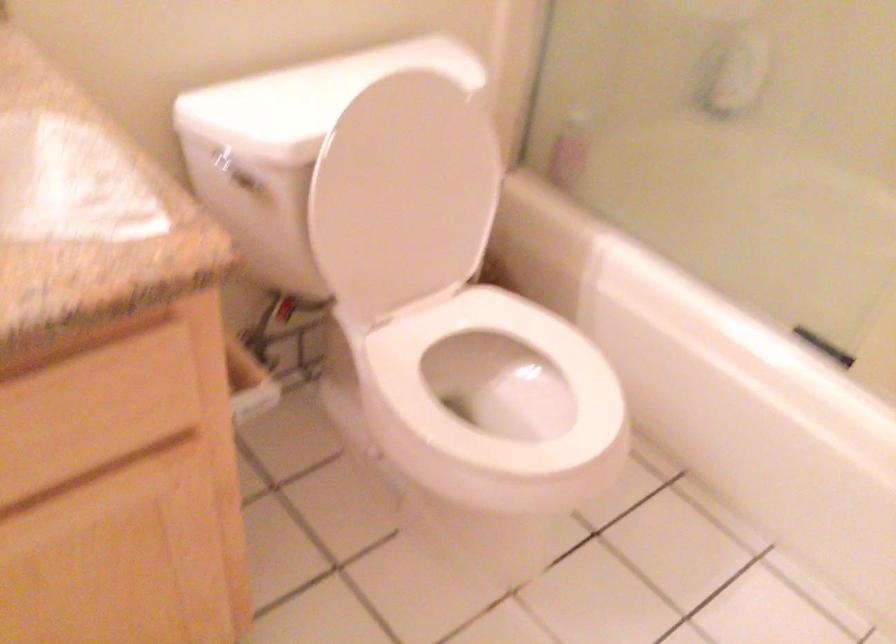
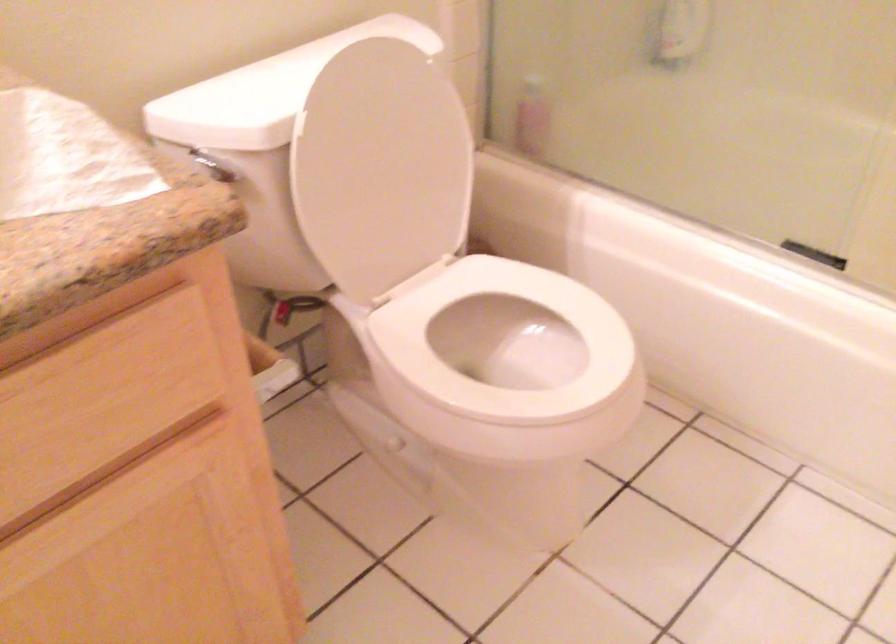
In the second image, find the point that corresponds to (496,383) in the first image.

(504, 348)